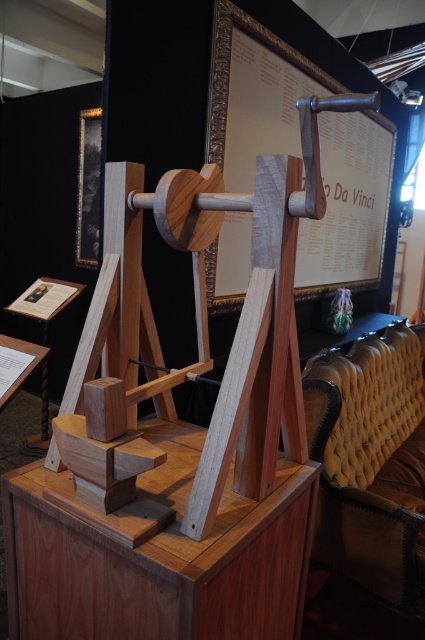
You are a visitor in the museum and want to sit down to rest. You see the wooden table at center and the leather tufted armchair at right. Which object is closer to you if you are standing in front of the pedestal?

The wooden table at center is closer to you because it is positioned under the leather tufted armchair at right, meaning the table is in front of the chair from your perspective.

You are a visitor in the museum and want to sit down to read the wooden framed poster at center. Is the leather tufted armchair at right close enough to the poster for you to read comfortably?

The wooden framed poster at center is bigger than the leather tufted armchair at right, but the description does not provide information about their distance. Therefore, it is unclear if the leather tufted armchair at right is close enough to the poster for comfortable reading.